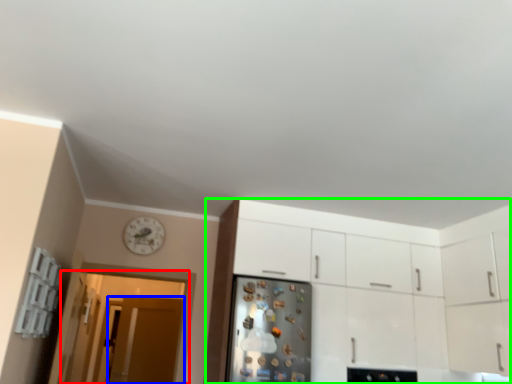
Question: Considering the real-world distances, which object is farthest from glass door (highlighted by a red box)? door (highlighted by a blue box) or cabinetry (highlighted by a green box)?

Choices:
 (A) door
 (B) cabinetry

Answer: (B)